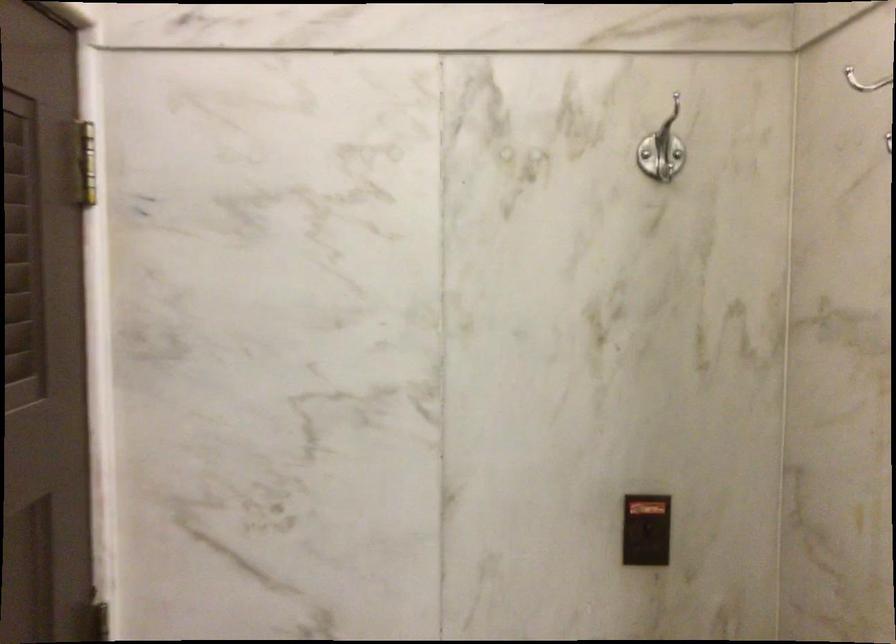
The location [645,529] corresponds to which object?

This point indicates the wall keycard slot.